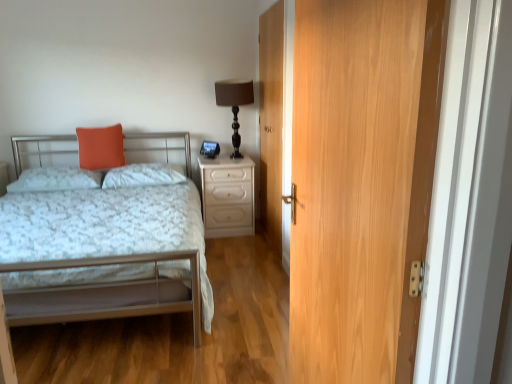
Where is `light brown wood door at right, which is counted as the 2th door, starting from the back`? The height and width of the screenshot is (384, 512). light brown wood door at right, which is counted as the 2th door, starting from the back is located at coordinates (361, 183).

Measure the distance between point (240, 212) and camera.

They are 3.96 meters apart.

At what (x,y) coordinates should I click in order to perform the action: click on metallic silver bed at left. Please return your answer as a coordinate pair (x, y). This screenshot has height=384, width=512. Looking at the image, I should click on [102, 252].

Describe the element at coordinates (55, 179) in the screenshot. I see `matte orange pillow at upper left, the first pillow positioned from the left` at that location.

The image size is (512, 384). Describe the element at coordinates (101, 147) in the screenshot. I see `orange matte pillow at upper left` at that location.

You are a GUI agent. You are given a task and a screenshot of the screen. Output one action in this format:
    pyautogui.click(x=<x>, y=<y>)
    Task: Click on the white fluffy pillow at center, which is the first pillow in right-to-left order
    The width and height of the screenshot is (512, 384).
    Given the screenshot: What is the action you would take?
    pyautogui.click(x=143, y=175)

Is point (117, 163) closer to camera compared to point (16, 191)?

No.

Is orange matte pillow at upper left to the right of matte orange pillow at upper left, the first pillow positioned from the left, from the viewer's perspective?

Yes, orange matte pillow at upper left is to the right of matte orange pillow at upper left, the first pillow positioned from the left.

Looking at this image, is orange matte pillow at upper left far from matte orange pillow at upper left, acting as the 2th pillow starting from the right?

No, orange matte pillow at upper left is in close proximity to matte orange pillow at upper left, acting as the 2th pillow starting from the right.

Measure the distance from orange matte pillow at upper left to matte orange pillow at upper left, the first pillow positioned from the left.

orange matte pillow at upper left is 10.64 inches from matte orange pillow at upper left, the first pillow positioned from the left.

Which object is thinner, matte orange pillow at upper left, the first pillow positioned from the left, or metallic silver bed at left?

Thinner between the two is matte orange pillow at upper left, the first pillow positioned from the left.

What are the coordinates of `bed below the matte orange pillow at upper left, acting as the 2th pillow starting from the right (from the image's perspective)` in the screenshot? It's located at (102, 252).

From the image's perspective, would you say matte orange pillow at upper left, acting as the 2th pillow starting from the right, is shown under metallic silver bed at left?

Actually, matte orange pillow at upper left, acting as the 2th pillow starting from the right, appears above metallic silver bed at left in the image.

Does point (86, 177) appear closer or farther from the camera than point (139, 248)?

Point (86, 177) is farther from the camera than point (139, 248).

How many degrees apart are the facing directions of wooden door at center, which appears as the first door when viewed from the back, and matte orange pillow at upper left, acting as the 2th pillow starting from the right?

The angular difference between wooden door at center, which appears as the first door when viewed from the back, and matte orange pillow at upper left, acting as the 2th pillow starting from the right, is 90.5 degrees.

Looking at the image, does wooden door at center, which appears as the first door when viewed from the back, seem bigger or smaller compared to matte orange pillow at upper left, the first pillow positioned from the left?

In the image, wooden door at center, which appears as the first door when viewed from the back, appears to be larger than matte orange pillow at upper left, the first pillow positioned from the left.

Which is closer to the camera, (273,174) or (71,173)?

Positioned in front is point (273,174).

From a real-world perspective, who is located lower, wooden door at center, which appears as the first door when viewed from the back, or matte orange pillow at upper left, acting as the 2th pillow starting from the right?

From a 3D spatial view, matte orange pillow at upper left, acting as the 2th pillow starting from the right, is below.

Visually, is metallic silver bed at left positioned to the left or to the right of orange matte pillow at upper left?

metallic silver bed at left is positioned on orange matte pillow at upper left's right side.

Is metallic silver bed at left not close to orange matte pillow at upper left?

Yes, metallic silver bed at left and orange matte pillow at upper left are located far from each other.

Is metallic silver bed at left in front of orange matte pillow at upper left?

Yes, metallic silver bed at left is in front of orange matte pillow at upper left.

From a real-world perspective, is metallic silver bed at left above or below orange matte pillow at upper left?

From a real-world perspective, metallic silver bed at left is physically below orange matte pillow at upper left.

The image size is (512, 384). I want to click on pillow that is the 1st one below the orange matte pillow at upper left (from a real-world perspective), so click(x=143, y=175).

From a real-world perspective, is white fluffy pillow at center, the 2th pillow viewed from the left, under orange matte pillow at upper left?

Correct, in the physical world, white fluffy pillow at center, the 2th pillow viewed from the left, is lower than orange matte pillow at upper left.

Based on the photo, is white fluffy pillow at center, the 2th pillow viewed from the left, inside or outside of orange matte pillow at upper left?

white fluffy pillow at center, the 2th pillow viewed from the left, is spatially situated outside orange matte pillow at upper left.

Considering the sizes of matte orange pillow at upper left, acting as the 2th pillow starting from the right, and orange matte pillow at upper left in the image, is matte orange pillow at upper left, acting as the 2th pillow starting from the right, bigger or smaller than orange matte pillow at upper left?

Considering their sizes, matte orange pillow at upper left, acting as the 2th pillow starting from the right, takes up more space than orange matte pillow at upper left.

Would you say matte orange pillow at upper left, the first pillow positioned from the left, is outside orange matte pillow at upper left?

Indeed, matte orange pillow at upper left, the first pillow positioned from the left, is completely outside orange matte pillow at upper left.

From the image's perspective, is matte orange pillow at upper left, the first pillow positioned from the left, on top of orange matte pillow at upper left?

Incorrect, from the image's perspective, matte orange pillow at upper left, the first pillow positioned from the left, is lower than orange matte pillow at upper left.

Is metallic silver bed at left wider or thinner than white glossy nightstand at right?

In the image, metallic silver bed at left appears to be wider than white glossy nightstand at right.

From the image's perspective, is metallic silver bed at left on top of white glossy nightstand at right?

No, from the image's perspective, metallic silver bed at left is not on top of white glossy nightstand at right.

Between metallic silver bed at left and white glossy nightstand at right, which one has more height?

metallic silver bed at left.

Which is behind, point (93, 220) or point (241, 183)?

The point (241, 183) is farther from the camera.

Locate an element on the screen. This screenshot has width=512, height=384. the 2nd pillow positioned below the orange matte pillow at upper left (from the image's perspective) is located at coordinates (55, 179).

I want to click on bed directly beneath the matte orange pillow at upper left, the first pillow positioned from the left (from a real-world perspective), so click(x=102, y=252).

From the image, which object appears to be nearer to orange matte pillow at upper left, metallic silver bed at left or white glossy nightstand at right?

The object closer to orange matte pillow at upper left is white glossy nightstand at right.

Considering their positions, is metallic silver bed at left positioned further to white fluffy pillow at center, the 2th pillow viewed from the left, than orange matte pillow at upper left?

Among the two, metallic silver bed at left is located further to white fluffy pillow at center, the 2th pillow viewed from the left.

From the image, which object appears to be farther from white glossy nightstand at right, light brown wood door at right, which is counted as the 2th door, starting from the back, or metallic silver bed at left?

light brown wood door at right, which is counted as the 2th door, starting from the back, is positioned further to the anchor white glossy nightstand at right.

Estimate the real-world distances between objects in this image. Which object is closer to white fluffy pillow at center, the 2th pillow viewed from the left, orange matte pillow at upper left or matte black table lamp at upper center?

orange matte pillow at upper left is closer to white fluffy pillow at center, the 2th pillow viewed from the left.

Considering their positions, is metallic silver bed at left positioned closer to matte orange pillow at upper left, the first pillow positioned from the left, than light brown wood door at right, which is counted as the 2th door, starting from the back?

metallic silver bed at left.

Which object lies nearer to the anchor point wooden door at center, which appears as the first door when viewed from the back, light brown wood door at right, the 1th door from the front, or metallic silver bed at left?

metallic silver bed at left is closer to wooden door at center, which appears as the first door when viewed from the back.

Based on their spatial positions, is matte orange pillow at upper left, the first pillow positioned from the left, or wooden door at center, which appears as the first door when viewed from the back, further from white glossy nightstand at right?

The object further to white glossy nightstand at right is matte orange pillow at upper left, the first pillow positioned from the left.

Estimate the real-world distances between objects in this image. Which object is further from matte orange pillow at upper left, acting as the 2th pillow starting from the right, light brown wood door at right, the 1th door from the front, or metallic silver bed at left?

light brown wood door at right, the 1th door from the front, lies further to matte orange pillow at upper left, acting as the 2th pillow starting from the right, than the other object.

I want to click on pillow between orange matte pillow at upper left and matte black table lamp at upper center, so point(143,175).

Identify the location of nightstand between matte orange pillow at upper left, the first pillow positioned from the left, and matte black table lamp at upper center, in the horizontal direction. (227, 196).

The height and width of the screenshot is (384, 512). What are the coordinates of `table lamp positioned between wooden door at center, placed as the 2th door when sorted from front to back, and white glossy nightstand at right from near to far` in the screenshot? It's located at (234, 104).

Locate an element on the screen. door located between light brown wood door at right, the 1th door from the front, and orange matte pillow at upper left in the depth direction is located at coordinates (271, 120).